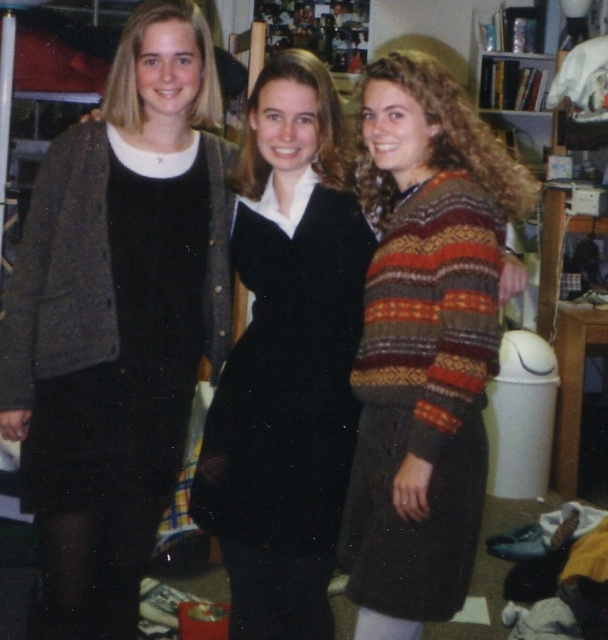
Can you confirm if knitted wool sweater at right is bigger than black velvet dress at center?

Yes.

Does point (368, 440) lie behind point (336, 236)?

No, it is in front of (336, 236).

Does point (412, 141) lie in front of point (266, 493)?

Yes, point (412, 141) is in front of point (266, 493).

The image size is (608, 640). I want to click on knitted wool sweater at right, so click(x=423, y=342).

Can you confirm if matte black dress at left is wider than knitted wool sweater at right?

Yes.

Image resolution: width=608 pixels, height=640 pixels. Describe the element at coordinates (117, 317) in the screenshot. I see `matte black dress at left` at that location.

You are a GUI agent. You are given a task and a screenshot of the screen. Output one action in this format:
    pyautogui.click(x=<x>, y=<y>)
    Task: Click on the matte black dress at left
    Image resolution: width=608 pixels, height=640 pixels.
    Given the screenshot: What is the action you would take?
    pyautogui.click(x=117, y=317)

This screenshot has height=640, width=608. In order to click on matte black dress at left in this screenshot , I will do `click(117, 317)`.

Is matte black dress at left thinner than black velvet dress at center?

In fact, matte black dress at left might be wider than black velvet dress at center.

Between point (83, 576) and point (266, 234), which one is positioned in front?

Point (83, 576) is more forward.

Does point (215, 372) come closer to viewer compared to point (299, 330)?

No, it is not.

The height and width of the screenshot is (640, 608). Identify the location of matte black dress at left. (117, 317).